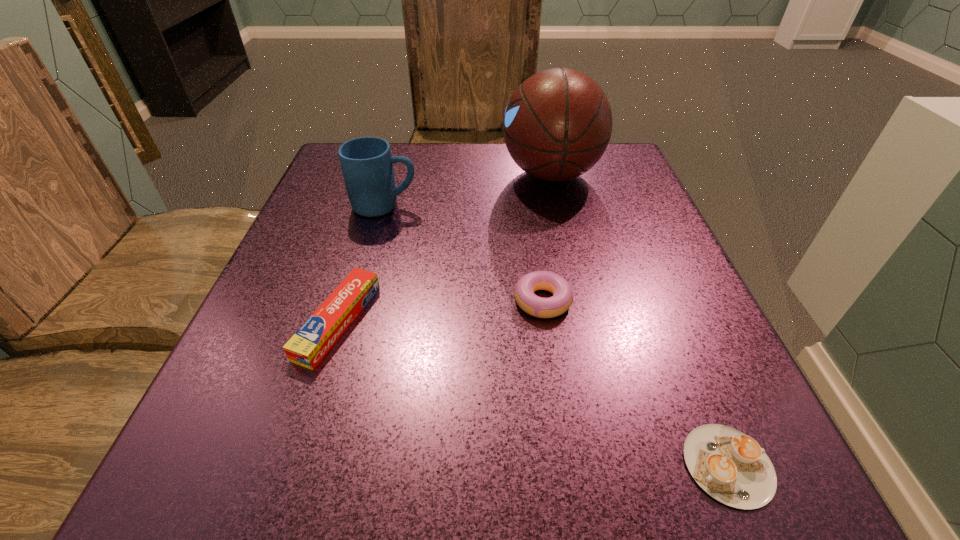
You are a GUI agent. You are given a task and a screenshot of the screen. Output one action in this format:
    pyautogui.click(x=<x>, y=<y>)
    Task: Click on the object present at the near right corner
    Image resolution: width=960 pixels, height=540 pixels.
    Given the screenshot: What is the action you would take?
    pyautogui.click(x=731, y=467)

The width and height of the screenshot is (960, 540). Find the location of `vacant space at the far edge`. vacant space at the far edge is located at coordinates (473, 184).

In order to click on free location at the near edge in this screenshot , I will do `click(654, 509)`.

Where is `vacant area at the left edge of the desktop`? vacant area at the left edge of the desktop is located at coordinates (303, 298).

At what (x,y) coordinates should I click in order to perform the action: click on free space at the right edge of the desktop. Please return your answer as a coordinate pair (x, y). Looking at the image, I should click on (588, 201).

At what (x,y) coordinates should I click in order to perform the action: click on vacant space at the far right corner of the desktop. Please return your answer as a coordinate pair (x, y). Image resolution: width=960 pixels, height=540 pixels. Looking at the image, I should click on 612,174.

This screenshot has width=960, height=540. What are the coordinates of `vacant space in between the second tallest object and the toothpaste` in the screenshot? It's located at (362, 264).

At what (x,y) coordinates should I click in order to perform the action: click on vacant space that's between the toothpaste and the basketball. Please return your answer as a coordinate pair (x, y). This screenshot has width=960, height=540. Looking at the image, I should click on (444, 248).

I want to click on vacant space that's between the toothpaste and the nearest object, so click(533, 393).

Find the location of `empty location between the nearest object and the tallest object`. empty location between the nearest object and the tallest object is located at coordinates (639, 320).